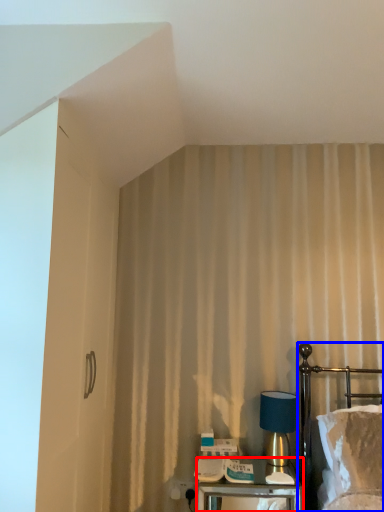
Question: Which point is further to the camera, nightstand (highlighted by a red box) or bed (highlighted by a blue box)?

Choices:
 (A) nightstand
 (B) bed

Answer: (A)